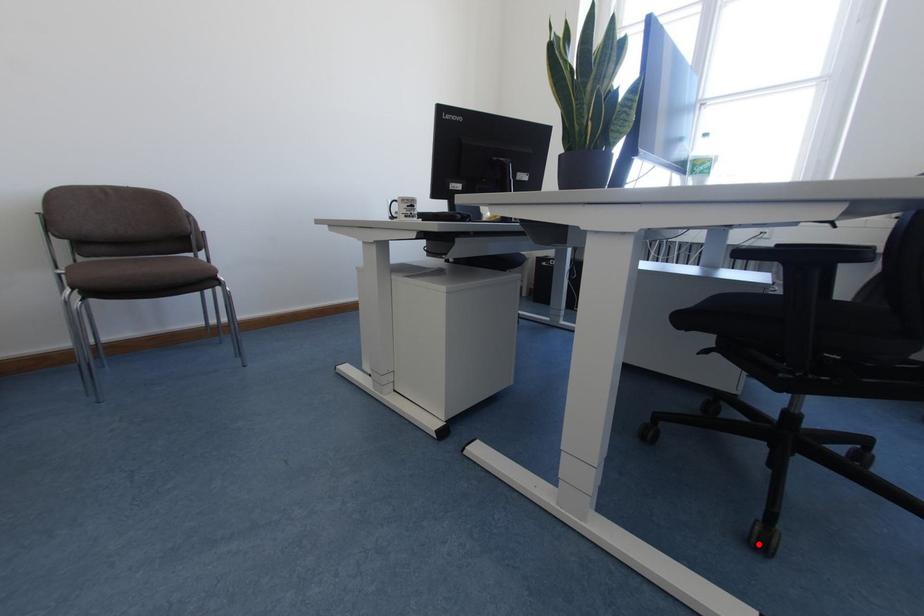
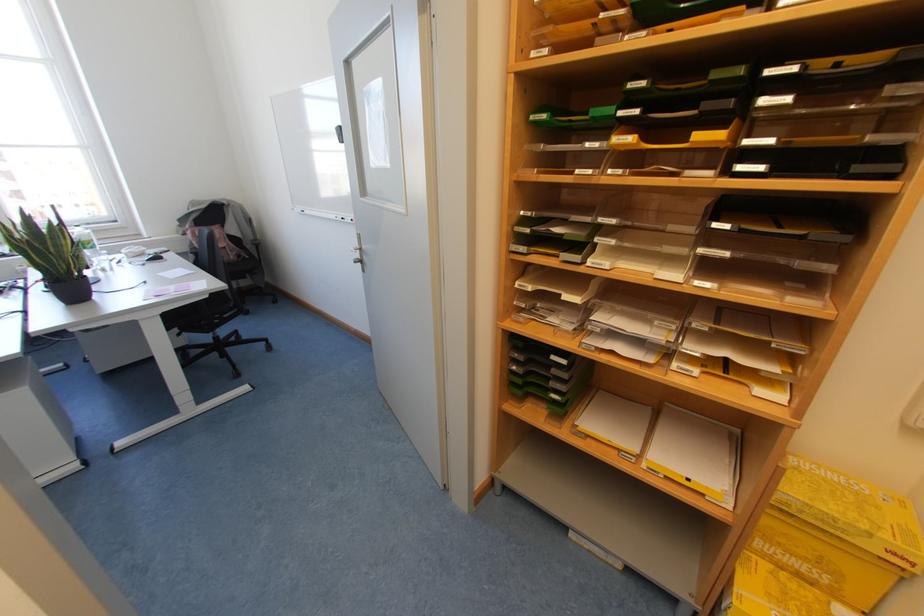
In the second image, find the point that corresponds to the highlighted location in the first image.

(236, 375)